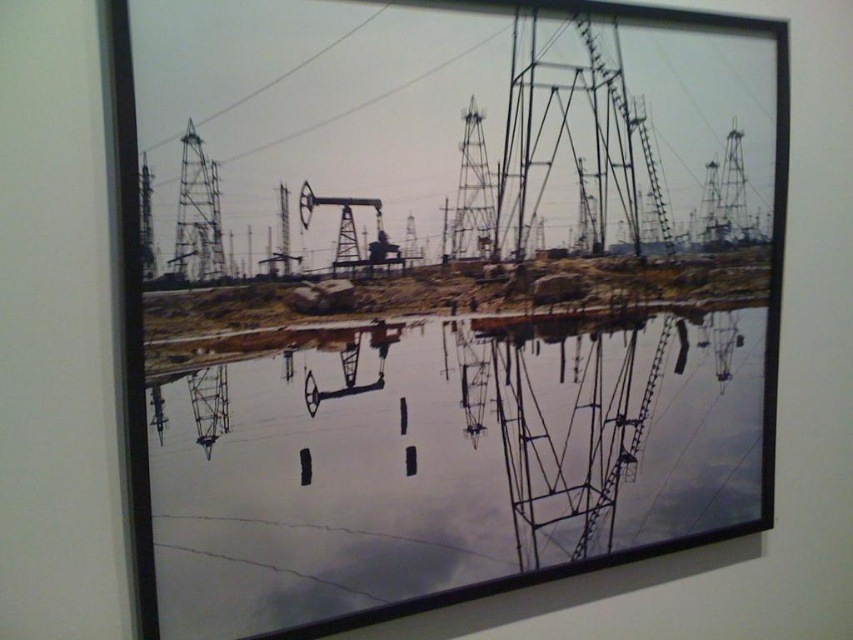
Question: Which is farther from the metallic wire at upper left?

Choices:
 (A) metallic wire at upper center
 (B) transparent glass water at center

Answer: (B)

Question: Which point is farther to the camera?

Choices:
 (A) (254, 147)
 (B) (245, 93)

Answer: (A)

Question: Which object is closer to the camera taking this photo?

Choices:
 (A) metallic wire at upper left
 (B) metallic wire at upper center

Answer: (A)

Question: Can you confirm if metallic wire at upper center is positioned above metallic wire at upper left?

Choices:
 (A) yes
 (B) no

Answer: (B)

Question: Is metallic wire at upper center below metallic wire at upper left?

Choices:
 (A) yes
 (B) no

Answer: (A)

Question: Is transparent glass water at center wider than metallic wire at upper center?

Choices:
 (A) no
 (B) yes

Answer: (B)